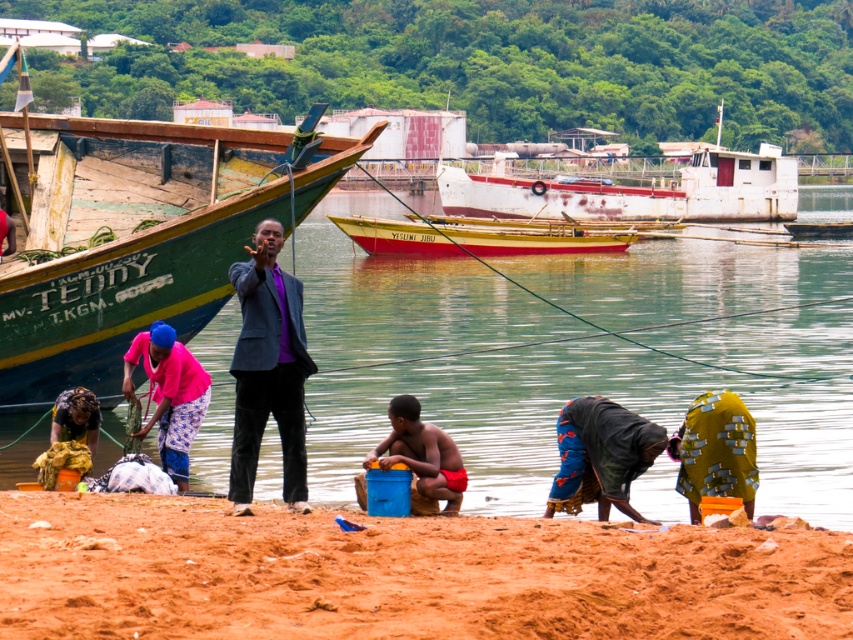
Question: Based on their relative distances, which object is farther from the yellow fabric at lower left?

Choices:
 (A) clear water at center
 (B) blue fabric bag at lower center
 (C) pink fabric at lower left

Answer: (A)

Question: Does clear water at center have a smaller size compared to pink fabric at lower left?

Choices:
 (A) no
 (B) yes

Answer: (A)

Question: Which of the following is the farthest from the observer?

Choices:
 (A) clear water at center
 (B) yellow polished wood boat at center
 (C) blue fabric bag at lower center

Answer: (B)

Question: Can you confirm if blue fabric bag at lower center is smaller than yellow fabric at lower right?

Choices:
 (A) yes
 (B) no

Answer: (B)

Question: Observing the image, what is the correct spatial positioning of rusty metal boat at center in reference to smooth plastic bucket at center?

Choices:
 (A) below
 (B) above

Answer: (B)

Question: Estimate the real-world distances between objects in this image. Which object is farther from the brown sandy beach at lower center?

Choices:
 (A) green wooden boat at left
 (B) pink fabric at lower left
 (C) rusty metal boat at center
 (D) yellow fabric at lower right

Answer: (C)